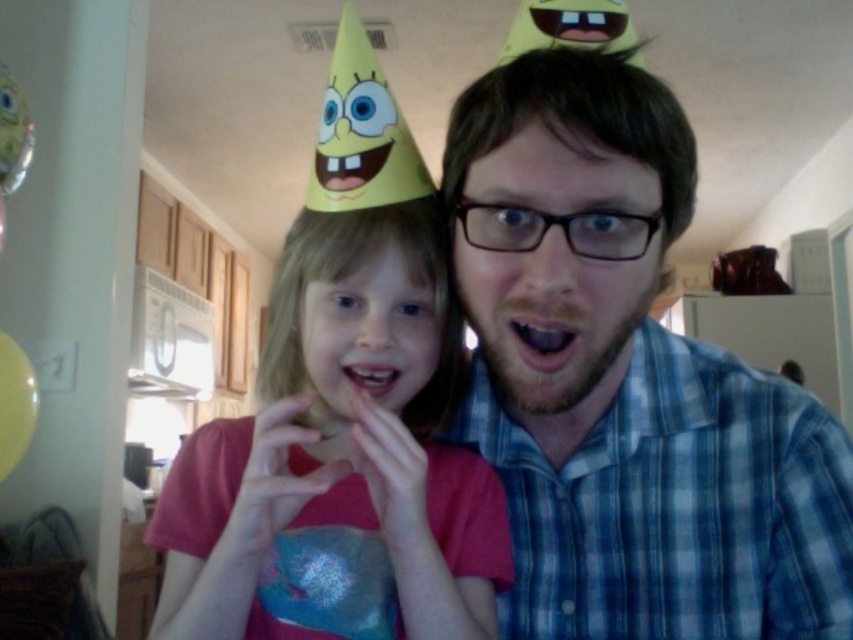
Between blue plaid shirt at center and pink fabric dress at center, which one has less height?

Standing shorter between the two is pink fabric dress at center.

Where is `blue plaid shirt at center`? blue plaid shirt at center is located at coordinates (628, 388).